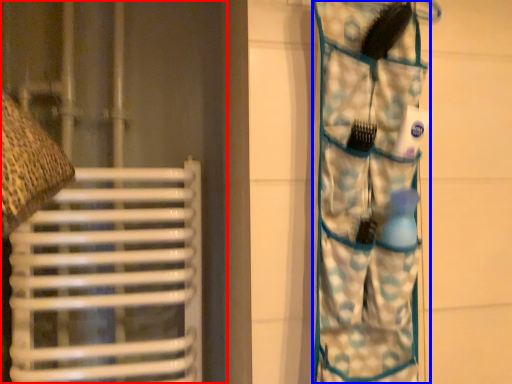
Question: Which point is further to the camera, curtain (highlighted by a red box) or camouflage (highlighted by a blue box)?

Choices:
 (A) curtain
 (B) camouflage

Answer: (A)